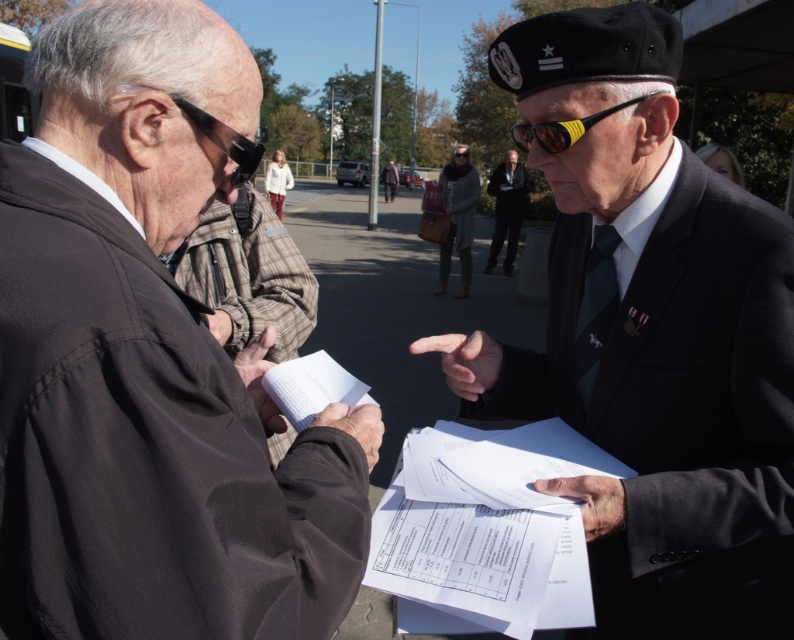
Which is in front, point (449, 173) or point (563, 136)?

Point (563, 136) is more forward.

Can you confirm if gray woolen robe at center is bigger than yellow rubber goggles at center?

Yes.

Does point (475, 193) come farther from viewer compared to point (557, 125)?

Yes, it is.

Identify the location of gray woolen robe at center. Image resolution: width=794 pixels, height=640 pixels. (457, 216).

Does white paper documents at center have a lesser height compared to black rubber goggles at left?

In fact, white paper documents at center may be taller than black rubber goggles at left.

Is white paper documents at center positioned in front of black rubber goggles at left?

No, it is not.

Find the location of a particular element. This screenshot has width=794, height=640. white paper documents at center is located at coordinates (488, 528).

You are a GUI agent. You are given a task and a screenshot of the screen. Output one action in this format:
    pyautogui.click(x=<x>, y=<y>)
    Task: Click on the white paper documents at center
    The image size is (794, 640).
    Given the screenshot: What is the action you would take?
    pyautogui.click(x=488, y=528)

Between point (525, 531) and point (567, 144), which one is positioned behind?

The point (567, 144) is more distant.

Does white paper documents at center have a greater height compared to yellow rubber goggles at center?

Indeed, white paper documents at center has a greater height compared to yellow rubber goggles at center.

Does point (561, 440) come closer to viewer compared to point (552, 145)?

That is False.

Locate an element on the screen. white paper documents at center is located at coordinates (488, 528).